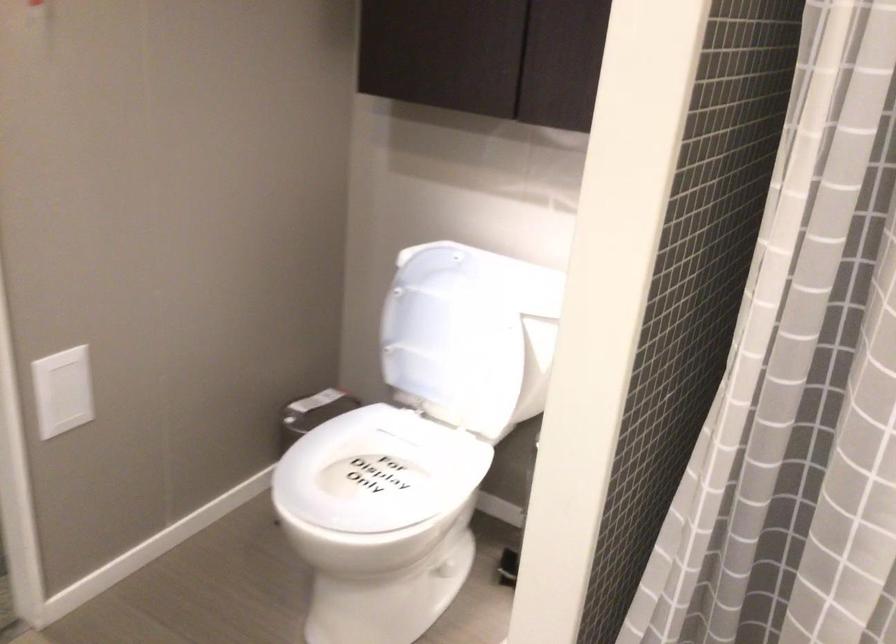
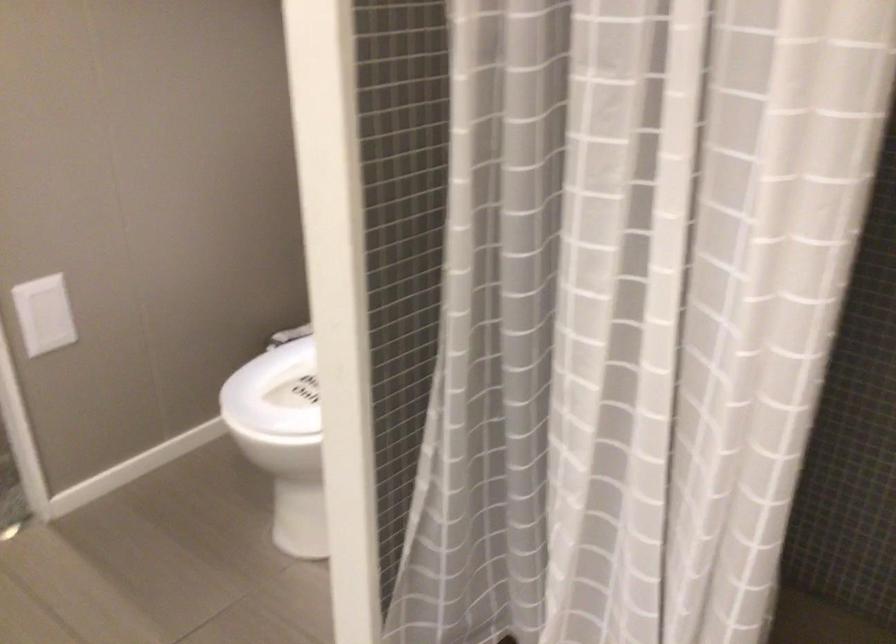
Locate, in the second image, the point that corresponds to (x=69, y=401) in the first image.

(53, 323)